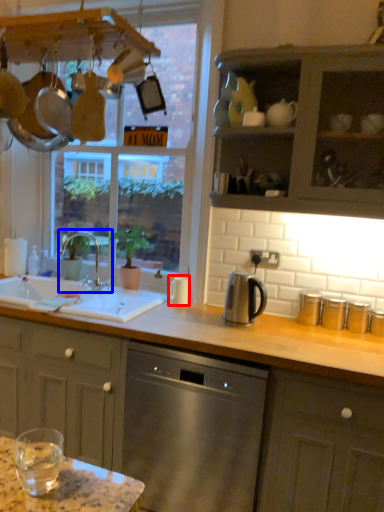
Question: Which object is further to the camera taking this photo, appliance (highlighted by a red box) or tap (highlighted by a blue box)?

Choices:
 (A) appliance
 (B) tap

Answer: (B)